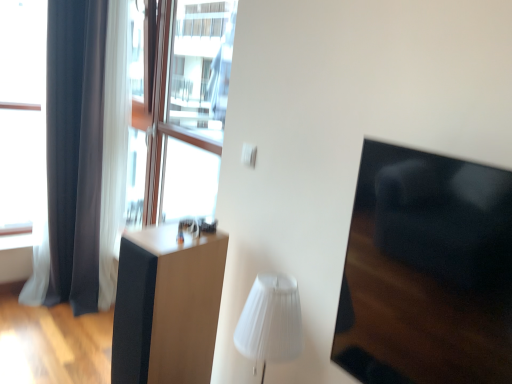
Question: Can you confirm if white pleated shade at center is wider than matte black speaker at center?

Choices:
 (A) yes
 (B) no

Answer: (B)

Question: Is white pleated shade at center at the right side of matte black speaker at center?

Choices:
 (A) no
 (B) yes

Answer: (B)

Question: Is matte black speaker at center at the back of white pleated shade at center?

Choices:
 (A) no
 (B) yes

Answer: (A)

Question: Does white pleated shade at center have a lesser width compared to matte black speaker at center?

Choices:
 (A) no
 (B) yes

Answer: (B)

Question: From the image's perspective, is white pleated shade at center above matte black speaker at center?

Choices:
 (A) no
 (B) yes

Answer: (B)

Question: Does point (168, 289) appear closer or farther from the camera than point (144, 99)?

Choices:
 (A) closer
 (B) farther

Answer: (A)

Question: In terms of width, does matte black speaker at center look wider or thinner when compared to transparent glass window at upper left?

Choices:
 (A) wide
 (B) thin

Answer: (A)

Question: From the image's perspective, is matte black speaker at center positioned above or below transparent glass window at upper left?

Choices:
 (A) below
 (B) above

Answer: (A)

Question: Considering the positions of matte black speaker at center and transparent glass window at upper left in the image, is matte black speaker at center taller or shorter than transparent glass window at upper left?

Choices:
 (A) tall
 (B) short

Answer: (B)

Question: Looking at their shapes, would you say dark gray fabric curtain at left is wider or thinner than matte black speaker at center?

Choices:
 (A) thin
 (B) wide

Answer: (A)

Question: In terms of height, does dark gray fabric curtain at left look taller or shorter compared to matte black speaker at center?

Choices:
 (A) short
 (B) tall

Answer: (B)

Question: Looking at the image, does dark gray fabric curtain at left seem bigger or smaller compared to matte black speaker at center?

Choices:
 (A) big
 (B) small

Answer: (A)

Question: Based on their positions, is dark gray fabric curtain at left located to the left or right of matte black speaker at center?

Choices:
 (A) left
 (B) right

Answer: (A)

Question: Is black glossy armchair at right inside the boundaries of dark gray fabric curtain at left, or outside?

Choices:
 (A) inside
 (B) outside

Answer: (B)

Question: From a real-world perspective, relative to dark gray fabric curtain at left, is black glossy armchair at right vertically above or below?

Choices:
 (A) below
 (B) above

Answer: (B)